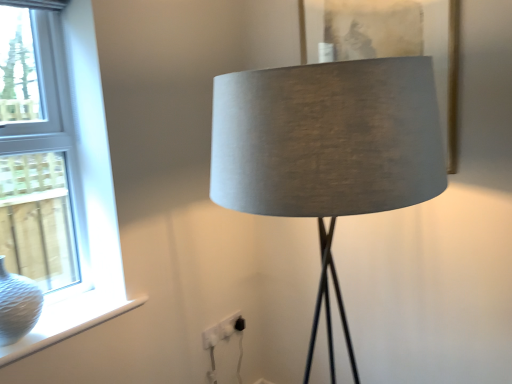
Question: Could you tell me if white glass window at left is facing satin grey lampshade at center?

Choices:
 (A) no
 (B) yes

Answer: (B)

Question: From the image's perspective, is white glass window at left above satin grey lampshade at center?

Choices:
 (A) no
 (B) yes

Answer: (B)

Question: Can you confirm if white glass window at left is smaller than satin grey lampshade at center?

Choices:
 (A) yes
 (B) no

Answer: (A)

Question: Can satin grey lampshade at center be found inside white glass window at left?

Choices:
 (A) yes
 (B) no

Answer: (B)

Question: From a real-world perspective, is white glass window at left physically above satin grey lampshade at center?

Choices:
 (A) no
 (B) yes

Answer: (B)

Question: Considering the positions of point (77, 296) and point (77, 41), is point (77, 296) closer or farther from the camera than point (77, 41)?

Choices:
 (A) farther
 (B) closer

Answer: (A)

Question: From the image's perspective, is white textured vase at lower left positioned above or below white glass window at left?

Choices:
 (A) above
 (B) below

Answer: (B)

Question: In terms of size, does white textured vase at lower left appear bigger or smaller than white glass window at left?

Choices:
 (A) big
 (B) small

Answer: (B)

Question: Would you say white textured vase at lower left is inside or outside white glass window at left?

Choices:
 (A) outside
 (B) inside

Answer: (B)

Question: Based on their sizes in the image, would you say white textured glass vase at left is bigger or smaller than white glass window at left?

Choices:
 (A) small
 (B) big

Answer: (A)

Question: Would you say white textured glass vase at left is inside or outside white glass window at left?

Choices:
 (A) outside
 (B) inside

Answer: (B)

Question: From a real-world perspective, is white textured glass vase at left above or below white glass window at left?

Choices:
 (A) above
 (B) below

Answer: (B)

Question: From the image's perspective, is white textured glass vase at left above or below white glass window at left?

Choices:
 (A) below
 (B) above

Answer: (A)

Question: Visually, is satin grey lampshade at center positioned to the left or to the right of white textured vase at lower left?

Choices:
 (A) right
 (B) left

Answer: (A)

Question: From the image's perspective, is satin grey lampshade at center above or below white textured vase at lower left?

Choices:
 (A) above
 (B) below

Answer: (A)